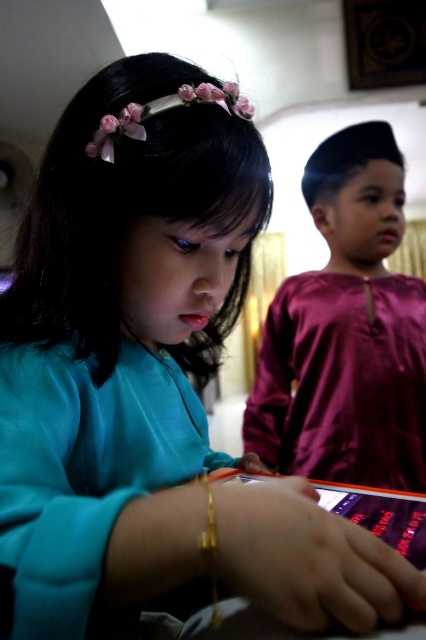
Question: Is shiny maroon shirt at center below gold metallic bracelet at lower center?

Choices:
 (A) no
 (B) yes

Answer: (A)

Question: Is shiny maroon shirt at center thinner than teal satin robe at lower left?

Choices:
 (A) no
 (B) yes

Answer: (A)

Question: Considering the real-world distances, which object is farthest from the shiny maroon shirt at center?

Choices:
 (A) gold metallic bracelet at lower center
 (B) teal satin robe at lower left
 (C) purple glossy book at lower center

Answer: (A)

Question: Is teal satin robe at lower left wider than purple glossy book at lower center?

Choices:
 (A) yes
 (B) no

Answer: (B)

Question: Which object is farther from the camera taking this photo?

Choices:
 (A) gold metallic bracelet at lower center
 (B) teal satin robe at lower left

Answer: (A)

Question: Which point is farther to the camera?

Choices:
 (A) gold metallic bracelet at lower center
 (B) teal satin robe at lower left
 (C) purple glossy book at lower center
 (D) shiny maroon shirt at center

Answer: (D)